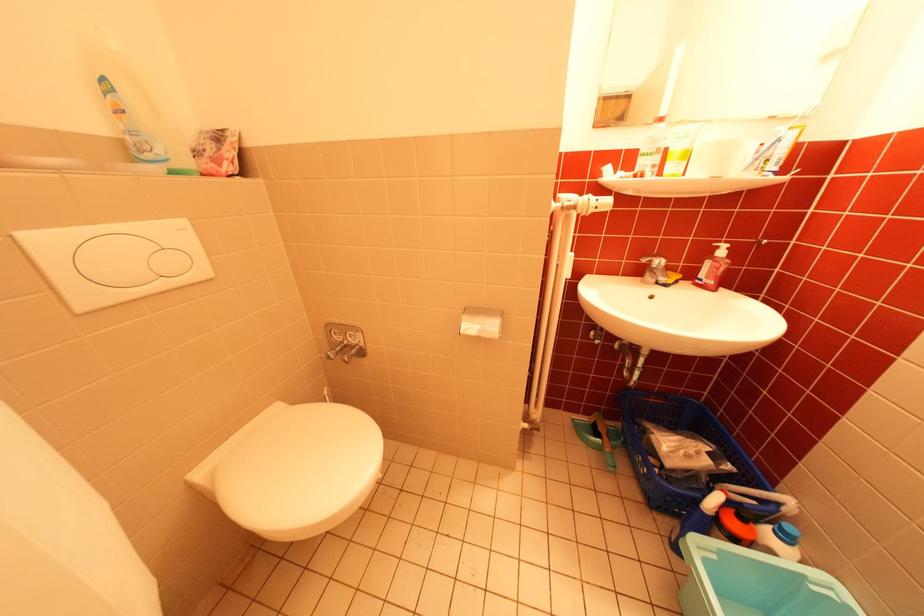
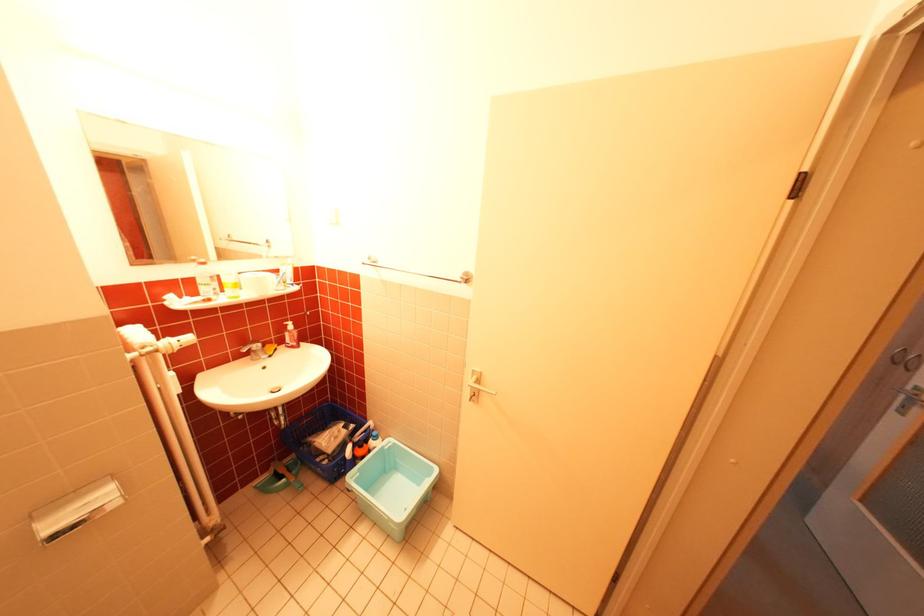
The point at (728,498) is marked in the first image. Where is the corresponding point in the second image?

(360, 448)